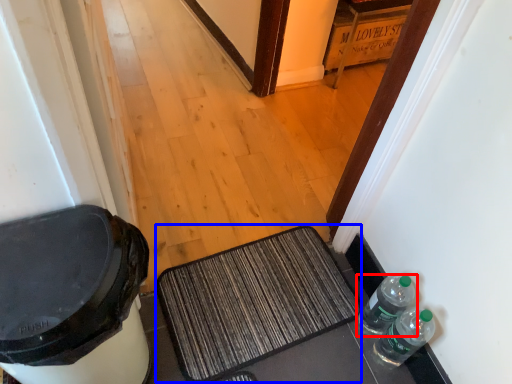
Question: Which of the following is the closest to the observer, bottle (highlighted by a red box) or doormat (highlighted by a blue box)?

Choices:
 (A) bottle
 (B) doormat

Answer: (A)